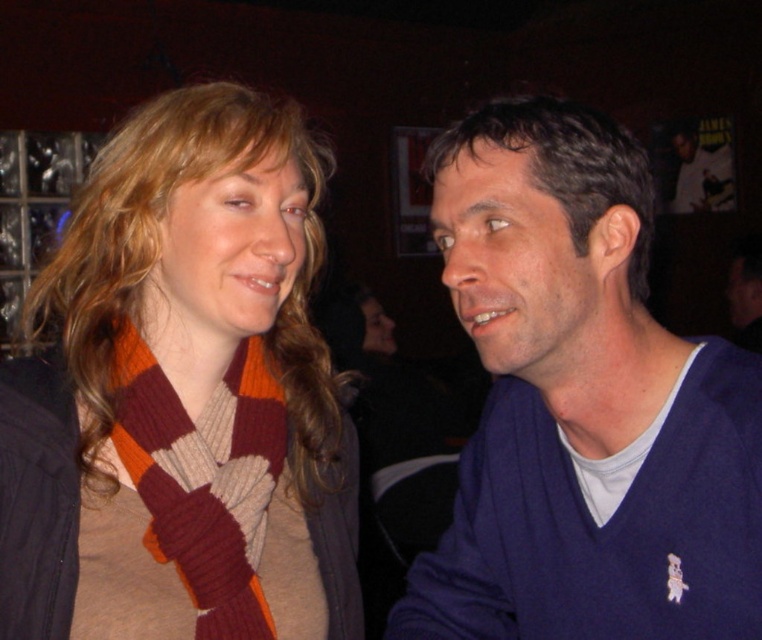
You are planning to gift a scarf to a friend who has the matte blue sweater at right. Based on the image, will the knitted wool scarf at left be narrower than the sweater?

The knitted wool scarf at left has a lesser width compared to matte blue sweater at right, so yes, the knitted wool scarf at left is narrower than the matte blue sweater at right.

You are a photographer trying to capture a candid shot of the two people in the scene. You want to ensure that the dark brown smooth hair at upper right and the matte blue sweater at right are both in focus. Which object should you focus on first to ensure both are sharp?

The dark brown smooth hair at upper right is above the matte blue sweater at right, so focusing on the dark brown smooth hair at upper right first will help ensure both are in focus as they are aligned vertically.